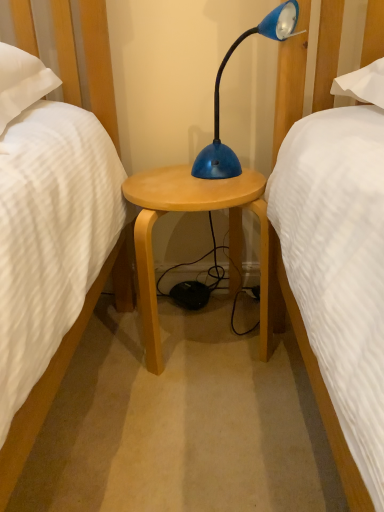
Identify the location of vacant space to the left of blue glossy desk lamp at center. (176, 180).